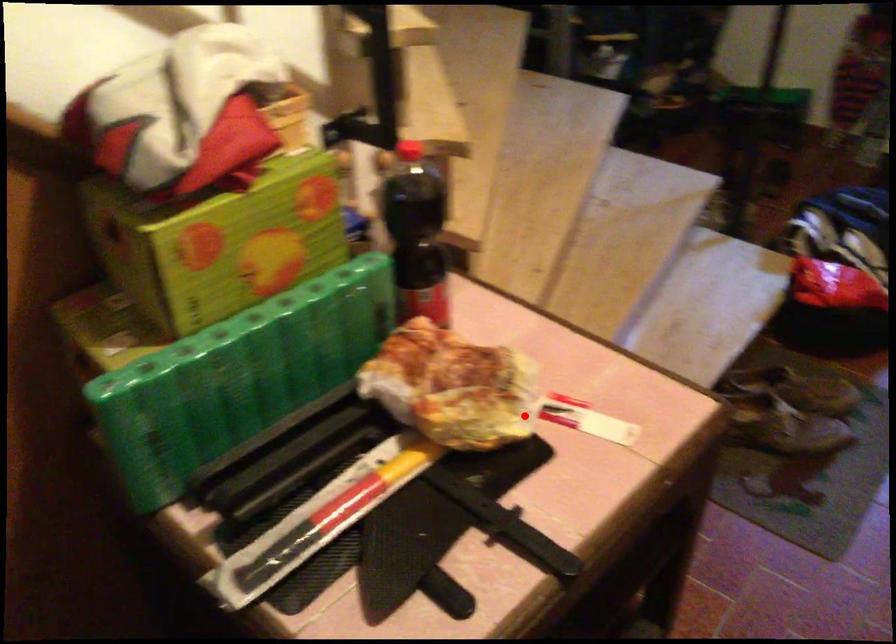
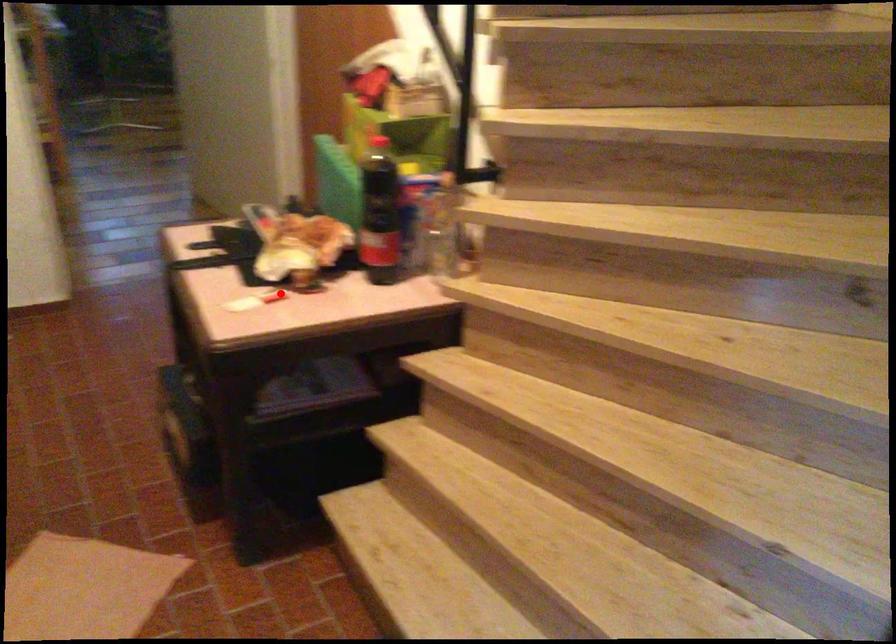
I am providing you with two images of the same scene from different viewpoints. A red point is marked on the first image and another point is marked on the second image. Is the marked point in image1 the same physical position as the marked point in image2?

Yes